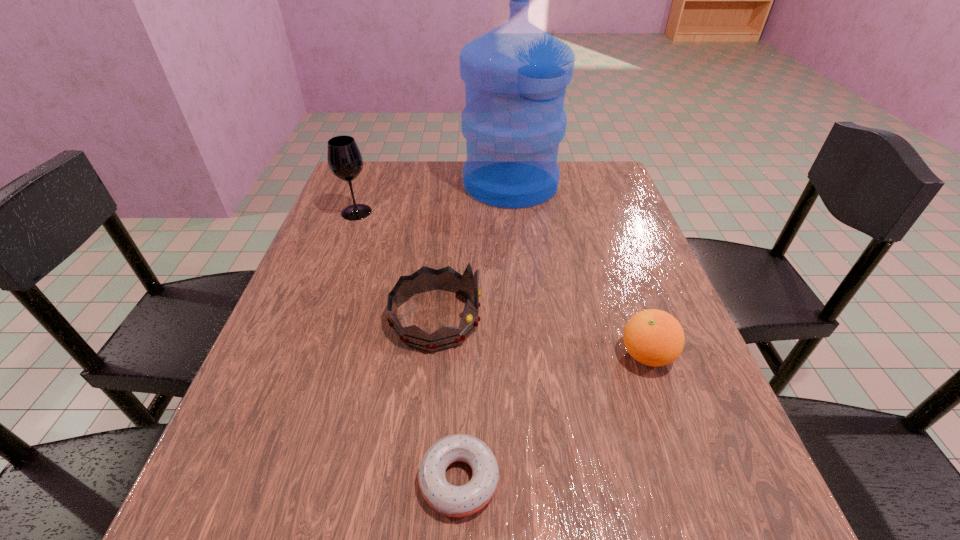
Where is `vacant region at the far right corner of the desktop`? Image resolution: width=960 pixels, height=540 pixels. vacant region at the far right corner of the desktop is located at coordinates (617, 193).

Find the location of `vacant space at the near right corner of the desktop`. vacant space at the near right corner of the desktop is located at coordinates (765, 531).

Where is `vacant area that lies between the orange and the tiara`? This screenshot has width=960, height=540. vacant area that lies between the orange and the tiara is located at coordinates (541, 336).

I want to click on free space between the tallest object and the second tallest object, so click(433, 198).

Where is `free spot between the water jug and the third tallest object`? The image size is (960, 540). free spot between the water jug and the third tallest object is located at coordinates point(473,251).

What are the coordinates of `free space between the tiara and the wineglass` in the screenshot? It's located at (396, 265).

The width and height of the screenshot is (960, 540). Identify the location of free space between the tiara and the orange. (541, 336).

Find the location of a particular element. The width and height of the screenshot is (960, 540). vacant area that lies between the water jug and the leftmost object is located at coordinates (433, 198).

You are a GUI agent. You are given a task and a screenshot of the screen. Output one action in this format:
    pyautogui.click(x=<x>, y=<y>)
    Task: Click on the free space between the tallest object and the shortest object
    The width and height of the screenshot is (960, 540).
    Given the screenshot: What is the action you would take?
    pyautogui.click(x=485, y=332)

The image size is (960, 540). What are the coordinates of `vacant space that's between the tiara and the tallest object` in the screenshot? It's located at (473, 251).